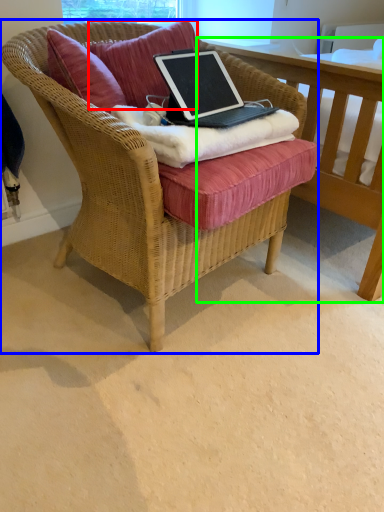
Question: Estimate the real-world distances between objects in this image. Which object is closer to pillow (highlighted by a red box), chair (highlighted by a blue box) or table (highlighted by a green box)?

Choices:
 (A) chair
 (B) table

Answer: (A)